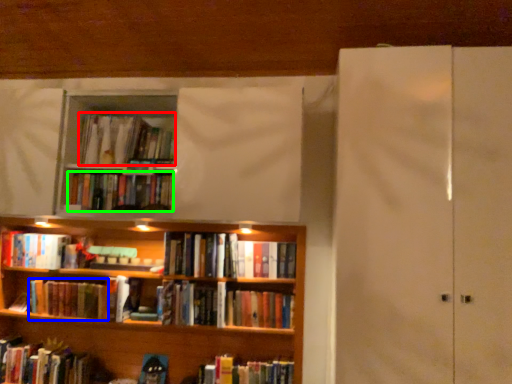
Question: Which object is the closest to the book (highlighted by a red box)? Choose among these: book (highlighted by a blue box) or book (highlighted by a green box).

Choices:
 (A) book
 (B) book

Answer: (B)